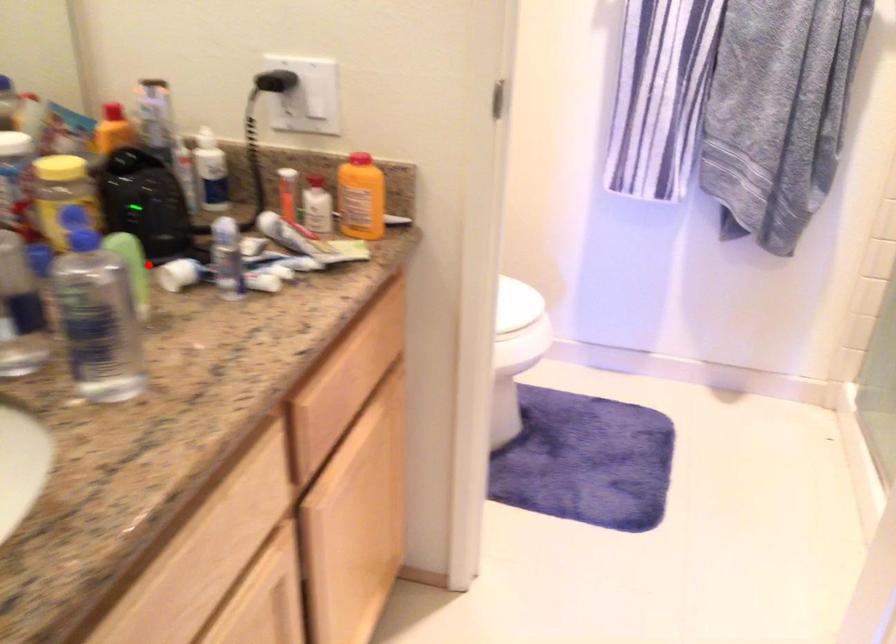
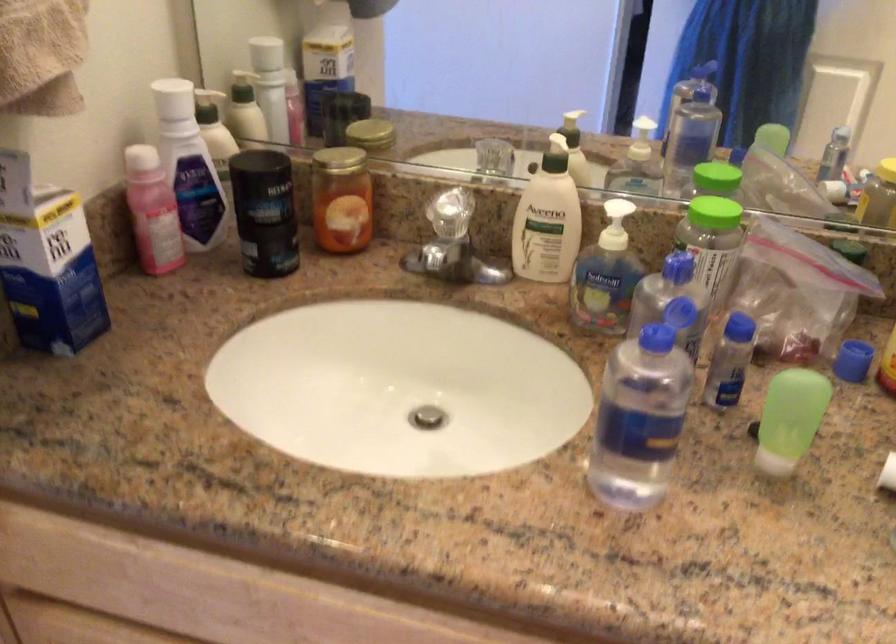
Find the pixel in the second image that matches the highlighted location in the first image.

(789, 419)